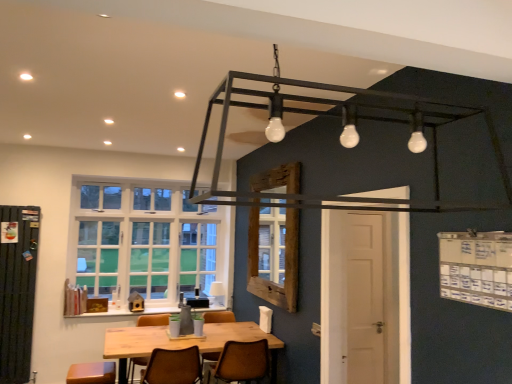
Question: From the image's perspective, would you say wooden table at center is shown under metallic black frame at upper center?

Choices:
 (A) no
 (B) yes

Answer: (B)

Question: Is wooden table at center oriented away from metallic black frame at upper center?

Choices:
 (A) yes
 (B) no

Answer: (B)

Question: Is wooden table at center shorter than metallic black frame at upper center?

Choices:
 (A) yes
 (B) no

Answer: (A)

Question: Does wooden table at center have a greater width compared to metallic black frame at upper center?

Choices:
 (A) no
 (B) yes

Answer: (B)

Question: Is wooden table at center further to camera compared to metallic black frame at upper center?

Choices:
 (A) no
 (B) yes

Answer: (B)

Question: Would you say wooden frame at center, the second window viewed from the left, is to the left or to the right of wooden table at center in the picture?

Choices:
 (A) right
 (B) left

Answer: (A)

Question: Relative to wooden table at center, is wooden frame at center, the second window in the back-to-front sequence, in front or behind?

Choices:
 (A) front
 (B) behind

Answer: (B)

Question: Considering the positions of point (273, 246) and point (177, 344), is point (273, 246) closer or farther from the camera than point (177, 344)?

Choices:
 (A) closer
 (B) farther

Answer: (B)

Question: In terms of height, does wooden frame at center, the first window from the right, look taller or shorter compared to wooden table at center?

Choices:
 (A) short
 (B) tall

Answer: (B)

Question: Looking at their shapes, would you say white ceramic lamp at center is wider or thinner than metallic black frame at upper center?

Choices:
 (A) thin
 (B) wide

Answer: (A)

Question: Is white ceramic lamp at center in front of or behind metallic black frame at upper center in the image?

Choices:
 (A) behind
 (B) front

Answer: (A)

Question: From a real-world perspective, relative to metallic black frame at upper center, is white ceramic lamp at center vertically above or below?

Choices:
 (A) below
 (B) above

Answer: (A)

Question: Considering the positions of point (222, 304) and point (429, 122), is point (222, 304) closer or farther from the camera than point (429, 122)?

Choices:
 (A) farther
 (B) closer

Answer: (A)

Question: From a real-world perspective, relative to white ceramic lamp at center, is wooden table at center vertically above or below?

Choices:
 (A) below
 (B) above

Answer: (A)

Question: Considering their positions, is wooden table at center located in front of or behind white ceramic lamp at center?

Choices:
 (A) behind
 (B) front

Answer: (B)